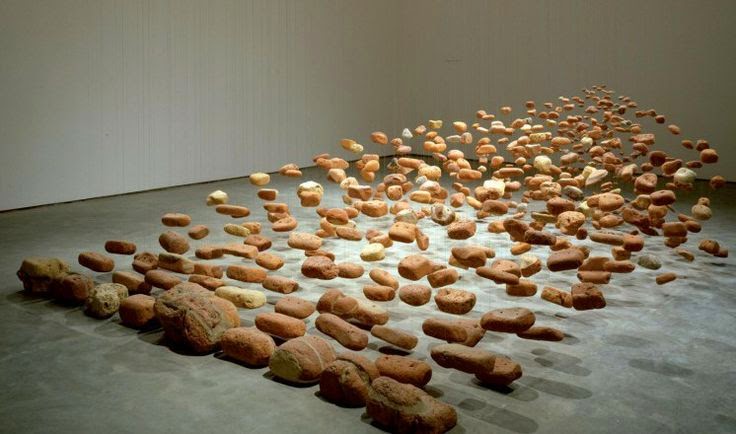
You are a GUI agent. You are given a task and a screenshot of the screen. Output one action in this format:
    pyautogui.click(x=<x>, y=<y>)
    Task: Click on the horizontal where walls meet floor
    The height and width of the screenshot is (434, 736).
    Given the screenshot: What is the action you would take?
    pyautogui.click(x=163, y=190), pyautogui.click(x=701, y=180)